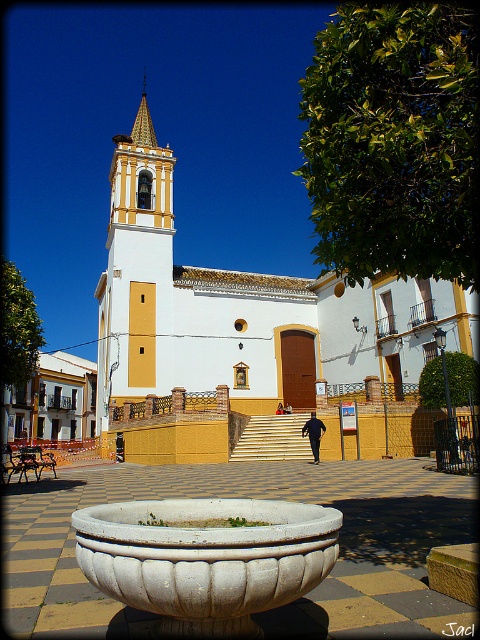
You are a landscape architect designing a garden path that needs to pass between the white stucco church at center and the white stone bowl at center. Based on their widths, can you determine if the path will be narrow or wide?

The white stucco church at center might be wider than white stone bowl at center, so the path between them could be narrow if the church is indeed wider, but the exact width isn

You are standing at the location of the dark blue fabric man at center. You want to walk to the white stucco church at center. How many steps would you need to take if each step is approximately 0.75 meters?

The distance between the white stucco church at center and the dark blue fabric man at center is 23.74 meters. If each step is 0.75 meters, you would need approximately 31.65 steps. Since you can only take whole steps, you would need to take 32 steps to reach the church.